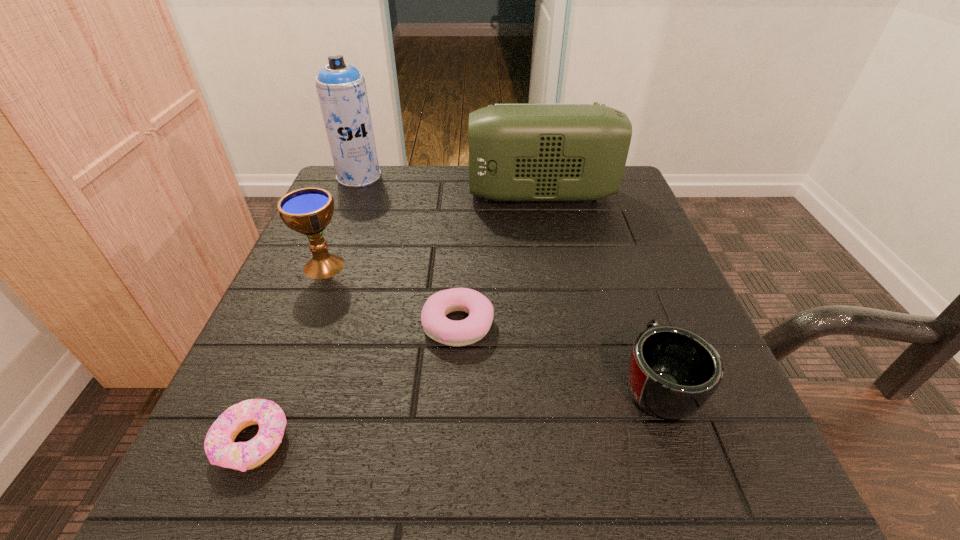
Locate an element on the screen. free location that satisfies the following two spatial constraints: 1. on the front side of the tallest object; 2. on the left side of the pastry is located at coordinates [x=299, y=325].